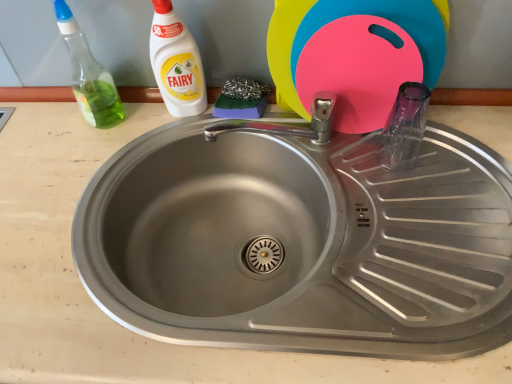
You are a GUI agent. You are given a task and a screenshot of the screen. Output one action in this format:
    pyautogui.click(x=<x>, y=<y>)
    Task: Click on the free space between green translucent spray bottle at left, which is counted as the first cleaning product, starting from the left, and white plastic bottle at upper left, which is counted as the 1th cleaning product, starting from the right
    Image resolution: width=512 pixels, height=384 pixels.
    Given the screenshot: What is the action you would take?
    pyautogui.click(x=146, y=120)